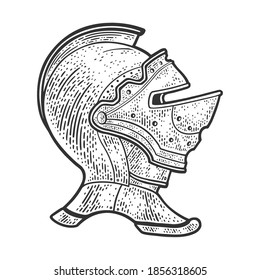
Where is `holes for air`? The width and height of the screenshot is (260, 280). holes for air is located at coordinates (133, 115), (155, 123), (170, 141), (188, 143), (188, 126), (178, 117).